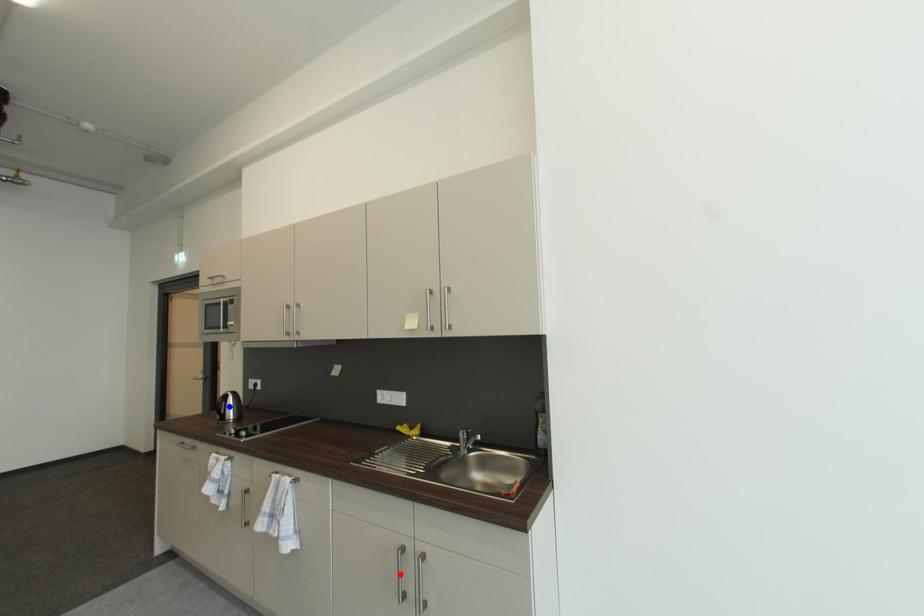
Question: In the image, two points are highlighted. Which point is nearer to the camera? Reply with the corresponding letter.

Choices:
 (A) blue point
 (B) red point

Answer: (B)